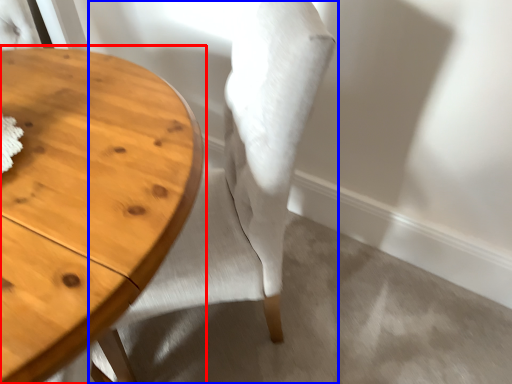
Question: Which object is closer to the camera taking this photo, table (highlighted by a red box) or chair (highlighted by a blue box)?

Choices:
 (A) table
 (B) chair

Answer: (A)